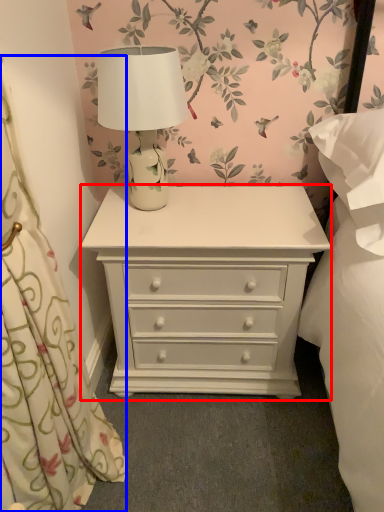
Question: Among these objects, which one is farthest to the camera, chest of drawers (highlighted by a red box) or curtain (highlighted by a blue box)?

Choices:
 (A) chest of drawers
 (B) curtain

Answer: (A)